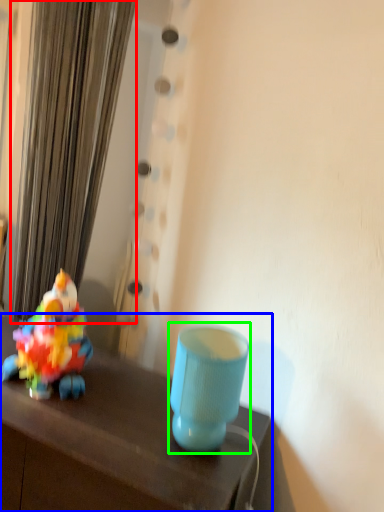
Question: Considering the real-world distances, which object is farthest from curtain (highlighted by a red box)? table (highlighted by a blue box) or table lamp (highlighted by a green box)?

Choices:
 (A) table
 (B) table lamp

Answer: (B)